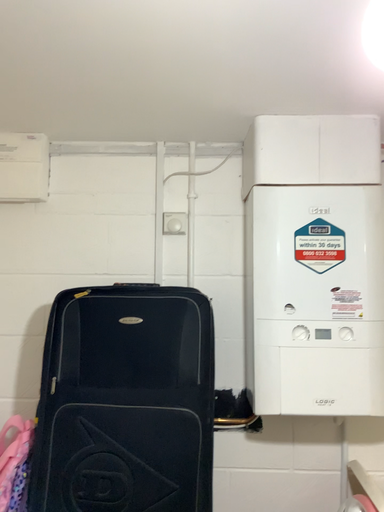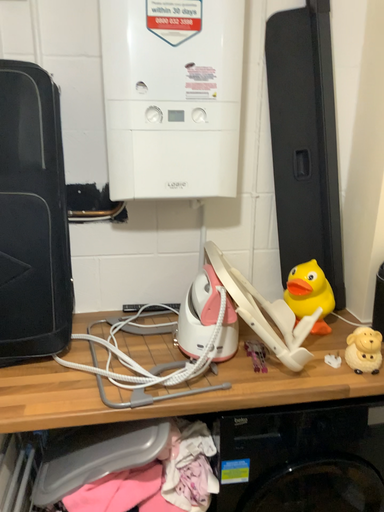
Question: Which way did the camera rotate in the video?

Choices:
 (A) rotated right
 (B) rotated left

Answer: (A)